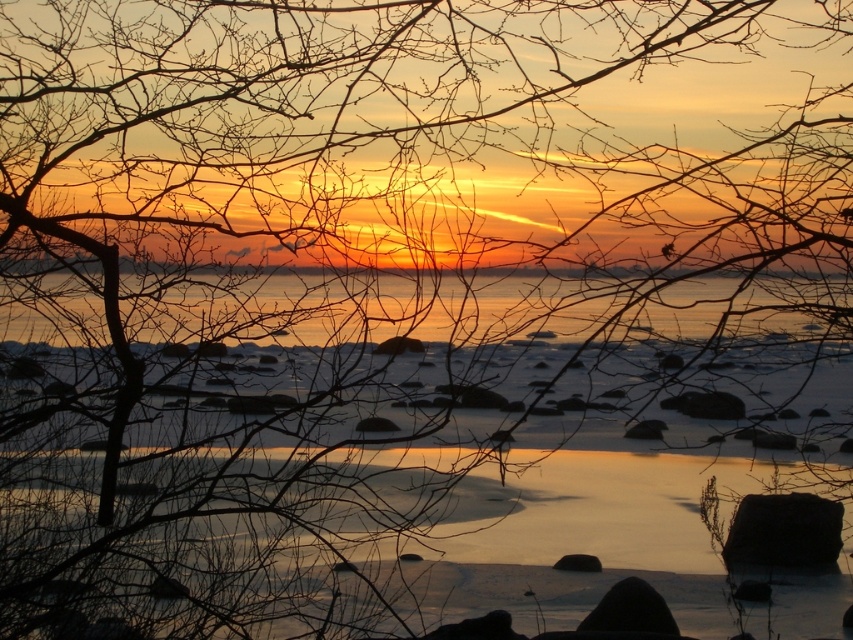
Is point (820, 500) farther from viewer compared to point (598, 614)?

That is True.

Measure the distance between black matte stone at lower right and camera.

11.23 feet

Is point (744, 545) positioned before point (666, 611)?

No, it is behind (666, 611).

You are a GUI agent. You are given a task and a screenshot of the screen. Output one action in this format:
    pyautogui.click(x=<x>, y=<y>)
    Task: Click on the black matte stone at lower right
    
    Given the screenshot: What is the action you would take?
    pyautogui.click(x=784, y=531)